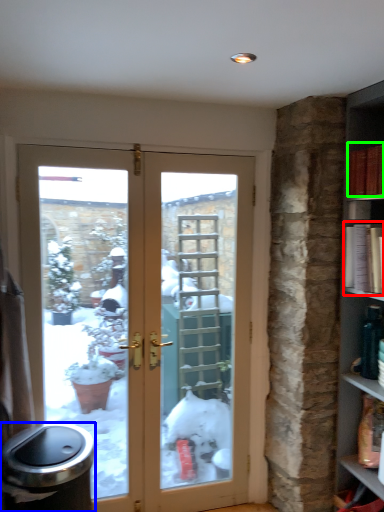
Question: Considering the real-world distances, which object is farthest from book (highlighted by a red box)? garbage (highlighted by a blue box) or book (highlighted by a green box)?

Choices:
 (A) garbage
 (B) book

Answer: (A)